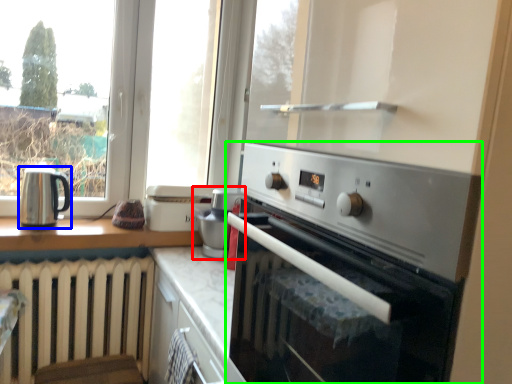
Question: Considering the real-world distances, which object is closest to appliance (highlighted by a red box)? kitchen appliance (highlighted by a blue box) or home appliance (highlighted by a green box).

Choices:
 (A) kitchen appliance
 (B) home appliance

Answer: (A)